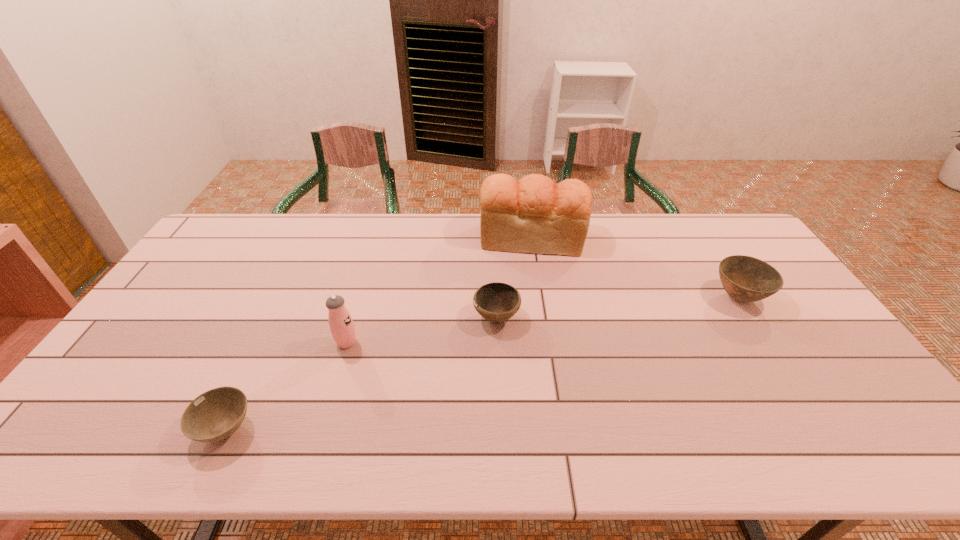
Where is `vacant area that lies between the second object from left to right and the tallest object`? The image size is (960, 540). vacant area that lies between the second object from left to right and the tallest object is located at coordinates (440, 291).

Locate an element on the screen. Image resolution: width=960 pixels, height=540 pixels. free spot between the farthest object and the second tallest object is located at coordinates (440, 291).

Locate an element on the screen. empty space that is in between the rightmost bowl and the leftmost object is located at coordinates (482, 363).

Image resolution: width=960 pixels, height=540 pixels. What are the coordinates of `the fourth closest object relative to the tallest object` in the screenshot? It's located at (216, 414).

Image resolution: width=960 pixels, height=540 pixels. I want to click on object that is the fourth nearest to the second tallest object, so click(x=746, y=279).

I want to click on the closest bowl to the second bowl from left to right, so click(216, 414).

Find the location of a particular element. Image resolution: width=960 pixels, height=540 pixels. bowl that stands as the third closest to the thermos bottle is located at coordinates (746, 279).

The width and height of the screenshot is (960, 540). I want to click on free point that satisfies the following two spatial constraints: 1. on the back side of the bread; 2. on the right side of the second bowl from right to left, so click(x=493, y=238).